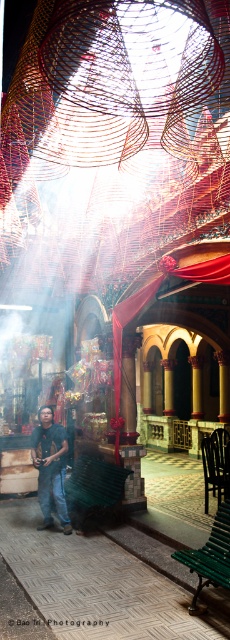
Question: Which object is farther from the camera taking this photo?

Choices:
 (A) green wooden bench at lower center
 (B) green plastic bench at lower center

Answer: (B)

Question: Observing the image, what is the correct spatial positioning of dark gray shirt at center in reference to green wooden bench at lower center?

Choices:
 (A) right
 (B) left

Answer: (B)

Question: Is green plastic bench at lower center behind dark gray shirt at center?

Choices:
 (A) yes
 (B) no

Answer: (B)

Question: Which point appears closest to the camera in this image?

Choices:
 (A) (82, 529)
 (B) (51, 426)

Answer: (A)

Question: From the image, what is the correct spatial relationship of green plastic bench at lower center in relation to green wooden bench at lower center?

Choices:
 (A) above
 (B) below

Answer: (B)

Question: Which object is positioned farthest from the green wooden bench at lower center?

Choices:
 (A) green plastic bench at lower center
 (B) dark gray shirt at center

Answer: (B)